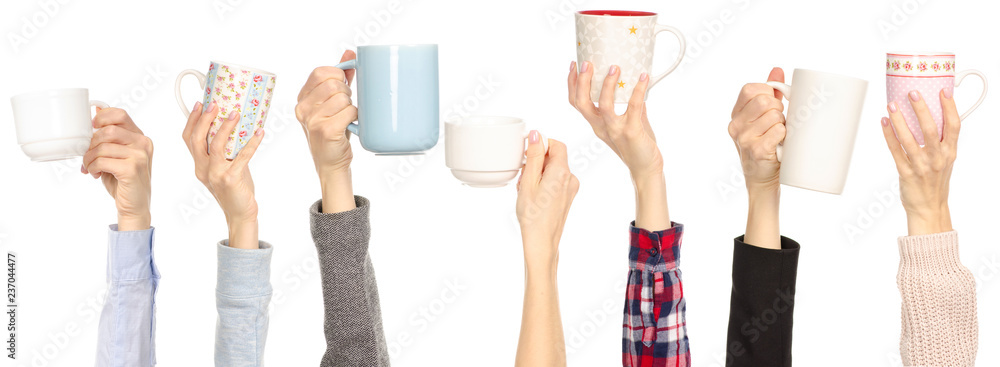
Identify the location of mug handle. Image resolution: width=1000 pixels, height=367 pixels. (182, 77), (101, 104), (350, 65), (529, 133), (683, 40), (778, 88), (967, 75).